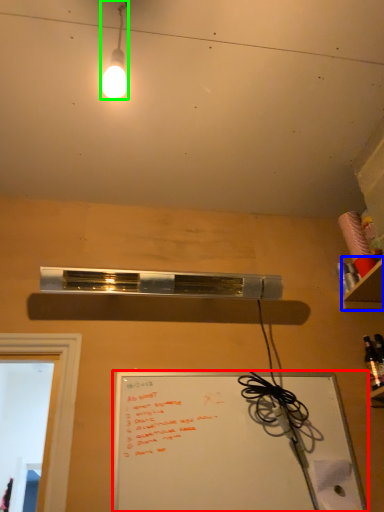
Question: Which object is positioned farthest from whiteboard (highlighted by a red box)? Select from shelf (highlighted by a blue box) and lamp (highlighted by a green box).

Choices:
 (A) shelf
 (B) lamp

Answer: (B)